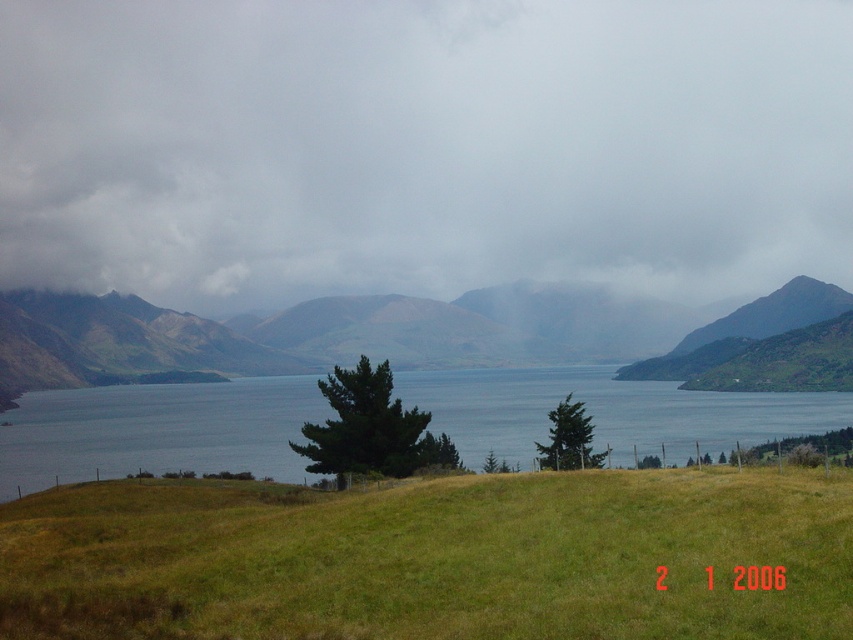
You are standing on the green grassy hill at lower center and want to reach the green grassy mountain at center. Which direction should you go to ascend?

You should go towards the green grassy mountain at center to ascend since it is taller than the green grassy hill at lower center.

Looking at this image, you are standing on the green grassy hill at lower center and want to reach the blue water at center. Based on the scene description, which direction should you walk to get to the water?

Since the green grassy hill at lower center is in the foreground and slopes gently towards the blue water at center, you should walk forward towards the water.

Looking at this image, you are standing on the green grassy hill at lower center and want to reach the green grassy mountain at center. Which direction should you move to get closer to the mountain?

You should move upward from the green grassy hill at lower center towards the green grassy mountain at center since the hill is below the mountain.